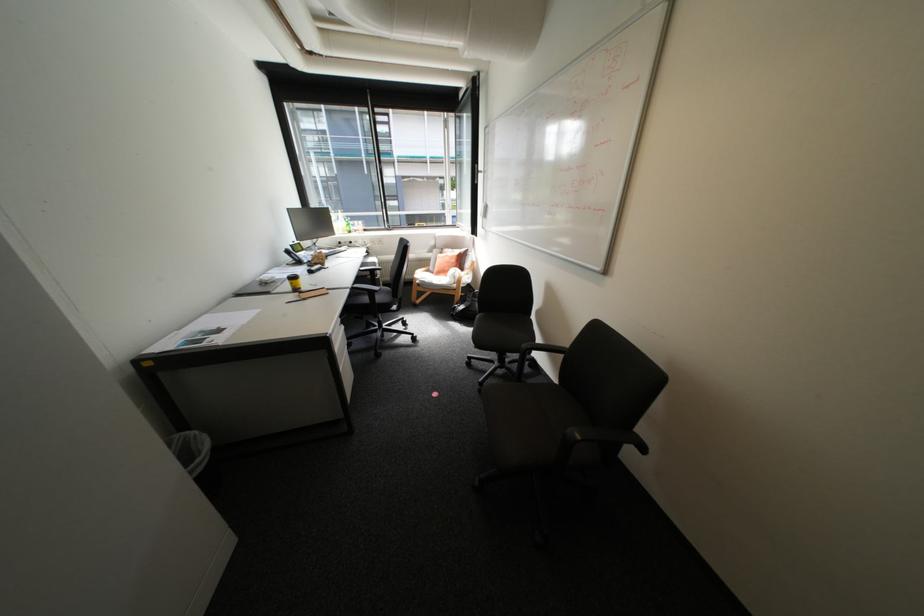
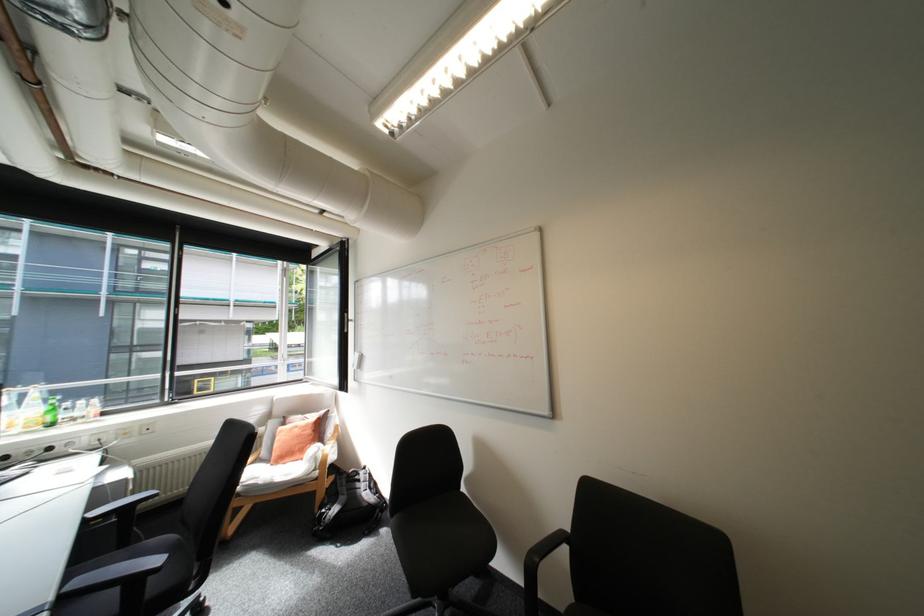
Where in the second image is the point corresponding to the point at 370,270 from the first image?

(94, 519)